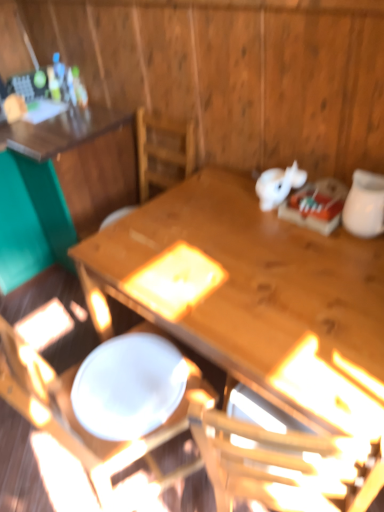
Question: Should I look upward or downward to see wooden table at upper left, which appears as the 2th table when viewed from the right?

Choices:
 (A) down
 (B) up

Answer: (B)

Question: Is wooden table at center, the 1th table positioned from the right, taller than wooden chair at center?

Choices:
 (A) yes
 (B) no

Answer: (B)

Question: Is wooden table at center, the 1th table positioned from the right, positioned with its back to wooden chair at center?

Choices:
 (A) no
 (B) yes

Answer: (A)

Question: Can you confirm if wooden table at center, the 1th table positioned from the right, is shorter than wooden chair at center?

Choices:
 (A) no
 (B) yes

Answer: (B)

Question: Does wooden table at center, the 1th table positioned from the right, have a greater width compared to wooden chair at center?

Choices:
 (A) no
 (B) yes

Answer: (B)

Question: Is wooden table at center, the 1th table positioned from the right, facing towards wooden chair at center?

Choices:
 (A) yes
 (B) no

Answer: (A)

Question: Is the surface of wooden table at center, the 1th table positioned from the right, in direct contact with wooden chair at center?

Choices:
 (A) yes
 (B) no

Answer: (B)

Question: Does white glossy plate at center appear on the left side of wooden table at center, the 1th table positioned from the right?

Choices:
 (A) yes
 (B) no

Answer: (A)

Question: From a real-world perspective, is white glossy plate at center physically below wooden table at center, the 1th table positioned from the right?

Choices:
 (A) yes
 (B) no

Answer: (B)

Question: Considering the relative sizes of white glossy plate at center and wooden table at center, which is the 2th table in left-to-right order, in the image provided, is white glossy plate at center smaller than wooden table at center, which is the 2th table in left-to-right order,?

Choices:
 (A) yes
 (B) no

Answer: (A)

Question: Is white glossy plate at center further to the viewer compared to wooden table at center, which is the 2th table in left-to-right order?

Choices:
 (A) yes
 (B) no

Answer: (A)

Question: From the image's perspective, would you say white glossy plate at center is shown under wooden table at center, which is the 2th table in left-to-right order?

Choices:
 (A) yes
 (B) no

Answer: (A)

Question: Is wooden table at center, the 1th table positioned from the right, at the back of white glossy plate at center?

Choices:
 (A) no
 (B) yes

Answer: (A)

Question: Is wooden table at center, the 1th table positioned from the right, shorter than white glossy jar at upper right?

Choices:
 (A) no
 (B) yes

Answer: (A)